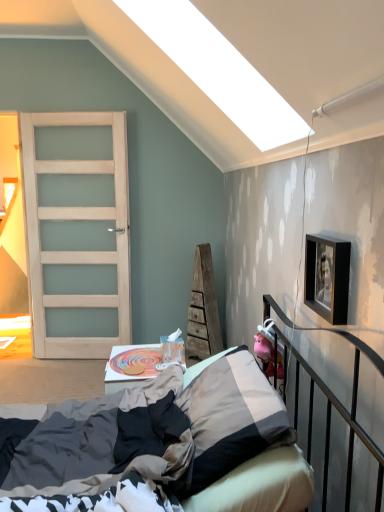
The height and width of the screenshot is (512, 384). Describe the element at coordinates (72, 439) in the screenshot. I see `textured beige bed at center` at that location.

I want to click on textured beige bed at center, so click(x=72, y=439).

The height and width of the screenshot is (512, 384). Describe the element at coordinates (327, 277) in the screenshot. I see `black matte picture frame at upper right` at that location.

The height and width of the screenshot is (512, 384). I want to click on textured gray pillow at center, so click(x=232, y=417).

At what (x,y) coordinates should I click in order to perform the action: click on wooden toy at center. Please return your answer as a coordinate pair (x, y). Looking at the image, I should click on (128, 364).

Image resolution: width=384 pixels, height=512 pixels. Describe the element at coordinates (128, 364) in the screenshot. I see `wooden toy at center` at that location.

The width and height of the screenshot is (384, 512). Identify the location of textured beige bed at center. (72, 439).

Which is correct: textured gray pillow at center is inside black matte picture frame at upper right, or outside of it?

textured gray pillow at center is outside black matte picture frame at upper right.

Is textured gray pillow at center wider or thinner than black matte picture frame at upper right?

textured gray pillow at center is wider than black matte picture frame at upper right.

From their relative heights in the image, would you say textured gray pillow at center is taller or shorter than black matte picture frame at upper right?

Considering their sizes, textured gray pillow at center has more height than black matte picture frame at upper right.

In the scene shown: From a real-world perspective, is textured beige bed at center positioned above or below black matte picture frame at upper right?

In terms of real-world spatial position, textured beige bed at center is below black matte picture frame at upper right.

Is textured beige bed at center aimed at black matte picture frame at upper right?

No, textured beige bed at center does not turn towards black matte picture frame at upper right.

Is textured beige bed at center next to black matte picture frame at upper right?

No, textured beige bed at center is not in contact with black matte picture frame at upper right.

How different are the orientations of textured beige bed at center and black matte picture frame at upper right in degrees?

Answer: The angular difference between textured beige bed at center and black matte picture frame at upper right is 0.653 degrees.

From a real-world perspective, is black matte picture frame at upper right located beneath textured beige bed at center?

Actually, black matte picture frame at upper right is physically above textured beige bed at center in the real world.

Which is more to the left, black matte picture frame at upper right or textured beige bed at center?

textured beige bed at center is more to the left.

Is black matte picture frame at upper right far from textured beige bed at center?

No, there isn't a large distance between black matte picture frame at upper right and textured beige bed at center.

From the image's perspective, is black matte picture frame at upper right above or below textured beige bed at center?

From the image's perspective, black matte picture frame at upper right appears above textured beige bed at center.

From a real-world perspective, is textured gray pillow at center under wooden toy at center?

No.

Considering the points (185, 497) and (159, 366), which point is behind, point (185, 497) or point (159, 366)?

The point (159, 366) is more distant.

Does textured gray pillow at center have a greater width compared to wooden toy at center?

Indeed, textured gray pillow at center has a greater width compared to wooden toy at center.

Where is `pillow lying above the wooden toy at center (from the image's perspective)`? This screenshot has width=384, height=512. pillow lying above the wooden toy at center (from the image's perspective) is located at coordinates (232, 417).

Considering the sizes of textured beige bed at center and textured gray pillow at center in the image, is textured beige bed at center wider or thinner than textured gray pillow at center?

Clearly, textured beige bed at center has more width compared to textured gray pillow at center.

Considering the relative positions of textured beige bed at center and textured gray pillow at center in the image provided, is textured beige bed at center to the left of textured gray pillow at center from the viewer's perspective?

Indeed, textured beige bed at center is positioned on the left side of textured gray pillow at center.

From their relative heights in the image, would you say textured beige bed at center is taller or shorter than textured gray pillow at center?

textured beige bed at center is taller than textured gray pillow at center.

Considering the sizes of textured beige bed at center and textured gray pillow at center in the image, is textured beige bed at center bigger or smaller than textured gray pillow at center?

In the image, textured beige bed at center appears to be larger than textured gray pillow at center.

Considering the relative sizes of satin wood door at left and textured beige bed at center in the image provided, is satin wood door at left taller than textured beige bed at center?

Indeed, satin wood door at left has a greater height compared to textured beige bed at center.

Measure the distance from satin wood door at left to textured beige bed at center.

satin wood door at left is 2.21 meters away from textured beige bed at center.

Is satin wood door at left looking in the opposite direction of textured beige bed at center?

No, satin wood door at left is not facing the opposite direction of textured beige bed at center.

From the image's perspective, does satin wood door at left appear lower than textured beige bed at center?

Actually, satin wood door at left appears above textured beige bed at center in the image.

From the picture: Which object is positioned more to the left, satin wood door at left or wooden toy at center?

satin wood door at left is more to the left.

In the scene shown: Can you confirm if satin wood door at left is shorter than wooden toy at center?

No, satin wood door at left is not shorter than wooden toy at center.

Find the location of a particular element. This screenshot has height=512, width=384. door behind the wooden toy at center is located at coordinates (77, 232).

In the image, is satin wood door at left positioned in front of or behind wooden toy at center?

Clearly, satin wood door at left is behind wooden toy at center.

Identify the location of pillow in front of the black matte picture frame at upper right. (232, 417).

At what (x,y) coordinates should I click in order to perform the action: click on bed on the left side of black matte picture frame at upper right. Please return your answer as a coordinate pair (x, y). Looking at the image, I should click on (72, 439).

Based on the photo, estimate the real-world distances between objects in this image. Which object is closer to wooden toy at center, satin wood door at left or textured gray pillow at center?

Among the two, textured gray pillow at center is located nearer to wooden toy at center.

Considering their positions, is textured gray pillow at center positioned further to black matte picture frame at upper right than textured beige bed at center?

textured gray pillow at center is positioned further to the anchor black matte picture frame at upper right.

Based on their spatial positions, is textured beige bed at center or satin wood door at left closer to black matte picture frame at upper right?

textured beige bed at center is positioned closer to the anchor black matte picture frame at upper right.

Based on their spatial positions, is black matte picture frame at upper right or textured gray pillow at center closer to textured beige bed at center?

Based on the image, textured gray pillow at center appears to be nearer to textured beige bed at center.

Which object lies nearer to the anchor point pink rubber piggy bank at right, textured gray pillow at center or satin wood door at left?

textured gray pillow at center is closer to pink rubber piggy bank at right.

Based on the photo, based on their spatial positions, is wooden toy at center or pink rubber piggy bank at right closer to black matte picture frame at upper right?

pink rubber piggy bank at right lies closer to black matte picture frame at upper right than the other object.

Which object lies further to the anchor point black matte picture frame at upper right, satin wood door at left or textured gray pillow at center?

satin wood door at left.

From the image, which object appears to be nearer to satin wood door at left, pink rubber piggy bank at right or textured beige bed at center?

pink rubber piggy bank at right.

The image size is (384, 512). I want to click on picture frame between textured gray pillow at center and pink rubber piggy bank at right along the z-axis, so click(x=327, y=277).

Find the location of `table positioned between textured gray pillow at center and satin wood door at left from near to far`. table positioned between textured gray pillow at center and satin wood door at left from near to far is located at coordinates (128, 364).

Where is `picture frame positioned between textured gray pillow at center and satin wood door at left from near to far`? The height and width of the screenshot is (512, 384). picture frame positioned between textured gray pillow at center and satin wood door at left from near to far is located at coordinates (327, 277).

I want to click on table between pink rubber piggy bank at right and satin wood door at left in the front-back direction, so click(x=128, y=364).